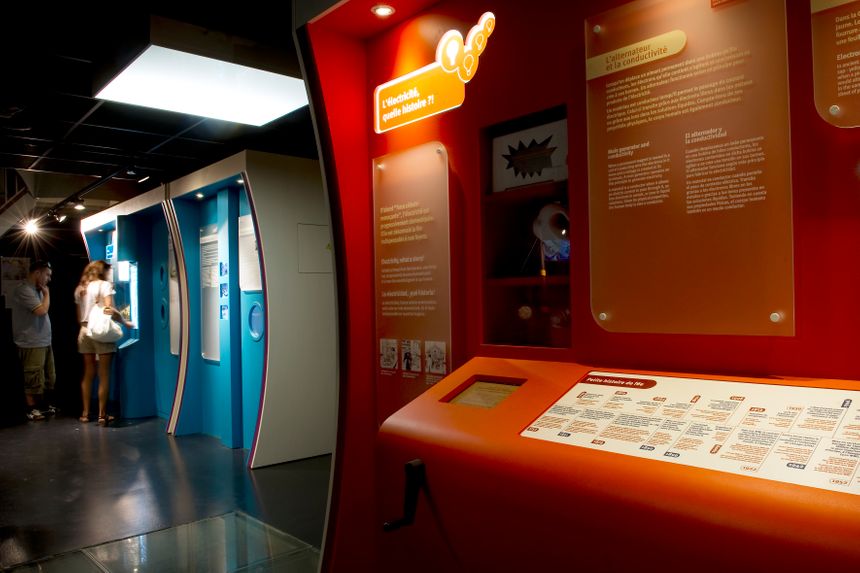
Locate an element on the screen. The image size is (860, 573). door is located at coordinates (243, 335), (163, 325).